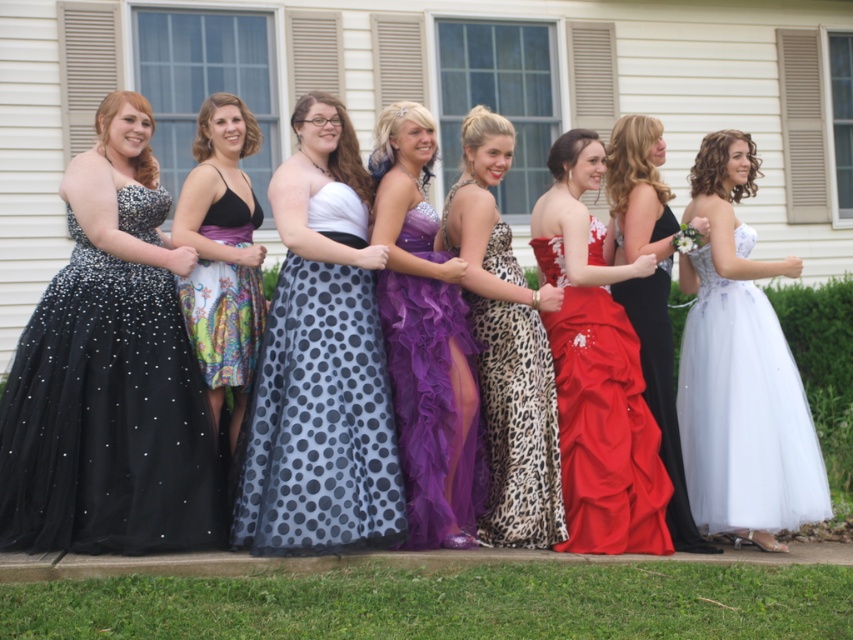
Question: Which point is closer to the camera?

Choices:
 (A) black sequined dress at left
 (B) red satin dress at center
 (C) polka dot tulle dress at center

Answer: (C)

Question: Estimate the real-world distances between objects in this image. Which object is farther from the purple tulle dress at center?

Choices:
 (A) leopard print dress at center
 (B) black sequined dress at left

Answer: (B)

Question: Among these objects, which one is farthest from the camera?

Choices:
 (A) leopard print dress at center
 (B) purple tulle dress at center
 (C) black sequined dress at left

Answer: (A)

Question: Can you confirm if red satin dress at center is smaller than matte black dress at center?

Choices:
 (A) no
 (B) yes

Answer: (A)

Question: From the image, what is the correct spatial relationship of polka dot tulle dress at center in relation to leopard print dress at center?

Choices:
 (A) below
 (B) above

Answer: (B)

Question: Can you confirm if white tulle dress at center is smaller than matte black dress at center?

Choices:
 (A) no
 (B) yes

Answer: (B)